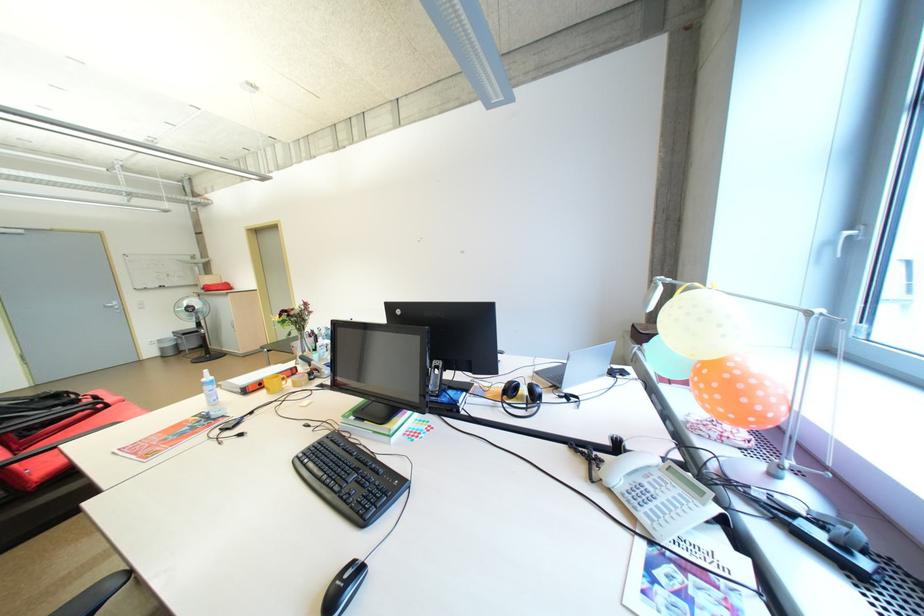
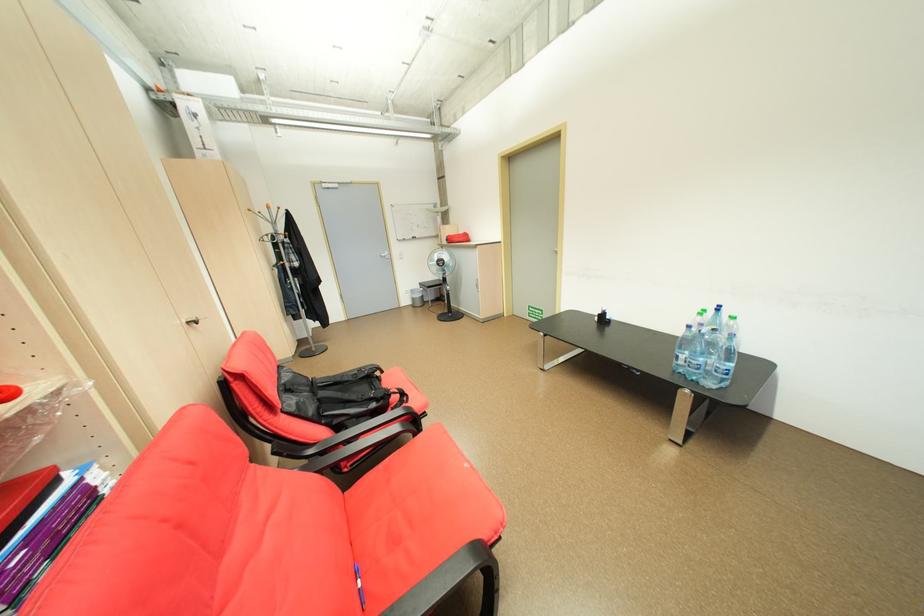
Locate, in the second image, the point that corresponds to (x=159, y=353) in the first image.

(415, 302)